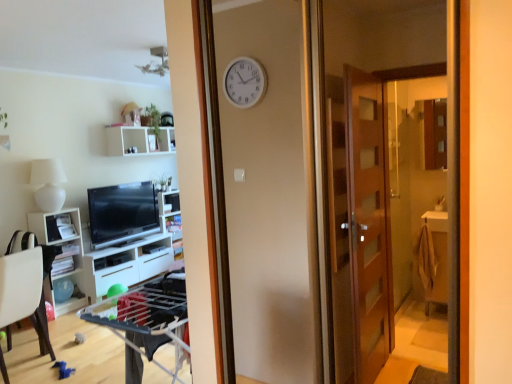
Question: Considering the relative sizes of white plastic chair at lower left and white glossy cabinet at left, which is counted as the second cabinetry, starting from the back, in the image provided, is white plastic chair at lower left shorter than white glossy cabinet at left, which is counted as the second cabinetry, starting from the back,?

Choices:
 (A) no
 (B) yes

Answer: (B)

Question: Is white glossy cabinet at left, which is counted as the second cabinetry, starting from the back, at the back of white plastic chair at lower left?

Choices:
 (A) no
 (B) yes

Answer: (A)

Question: From the image's perspective, would you say white plastic chair at lower left is shown under white glossy cabinet at left, which is counted as the second cabinetry, starting from the back?

Choices:
 (A) no
 (B) yes

Answer: (B)

Question: From the image's perspective, is white plastic chair at lower left over white glossy cabinet at left, which is counted as the second cabinetry, starting from the back?

Choices:
 (A) yes
 (B) no

Answer: (B)

Question: Does white plastic chair at lower left have a larger size compared to white glossy cabinet at left, which is counted as the second cabinetry, starting from the back?

Choices:
 (A) yes
 (B) no

Answer: (A)

Question: Relative to white matte shelf at upper center, arranged as the first shelf when viewed from the top, is white glossy shelf at center, which is the 3th shelf in top-to-bottom order, in front or behind?

Choices:
 (A) front
 (B) behind

Answer: (B)

Question: Based on their sizes in the image, would you say white glossy shelf at center, which is the 3th shelf in top-to-bottom order, is bigger or smaller than white matte shelf at upper center, marked as the third shelf in a bottom-to-top arrangement?

Choices:
 (A) big
 (B) small

Answer: (A)

Question: From a real-world perspective, relative to white matte shelf at upper center, arranged as the first shelf when viewed from the top, is white glossy shelf at center, which is the 3th shelf in top-to-bottom order, vertically above or below?

Choices:
 (A) below
 (B) above

Answer: (A)

Question: Considering the relative positions of white glossy shelf at center, the first shelf in the bottom-to-top sequence, and white matte shelf at upper center, arranged as the first shelf when viewed from the top, in the image provided, is white glossy shelf at center, the first shelf in the bottom-to-top sequence, to the left or to the right of white matte shelf at upper center, arranged as the first shelf when viewed from the top,?

Choices:
 (A) left
 (B) right

Answer: (B)

Question: From a real-world perspective, is white glossy shelf at center, which appears as the second shelf when viewed from the top, above or below white glossy cabinet at lower left, the second cabinetry when ordered from front to back?

Choices:
 (A) below
 (B) above

Answer: (B)

Question: From the image's perspective, relative to white glossy cabinet at lower left, positioned as the first cabinetry in back-to-front order, is white glossy shelf at center, which is the second shelf from bottom to top, above or below?

Choices:
 (A) above
 (B) below

Answer: (A)

Question: In terms of width, does white glossy shelf at center, which is the second shelf from bottom to top, look wider or thinner when compared to white glossy cabinet at lower left, positioned as the first cabinetry in back-to-front order?

Choices:
 (A) wide
 (B) thin

Answer: (B)

Question: Is point (164, 203) positioned closer to the camera than point (148, 273)?

Choices:
 (A) closer
 (B) farther

Answer: (B)

Question: From a real-world perspective, is white plastic chair at lower left positioned above or below white glossy shelf at center, which is the 3th shelf in top-to-bottom order?

Choices:
 (A) above
 (B) below

Answer: (B)

Question: Is point (45, 256) closer or farther from the camera than point (179, 243)?

Choices:
 (A) closer
 (B) farther

Answer: (A)